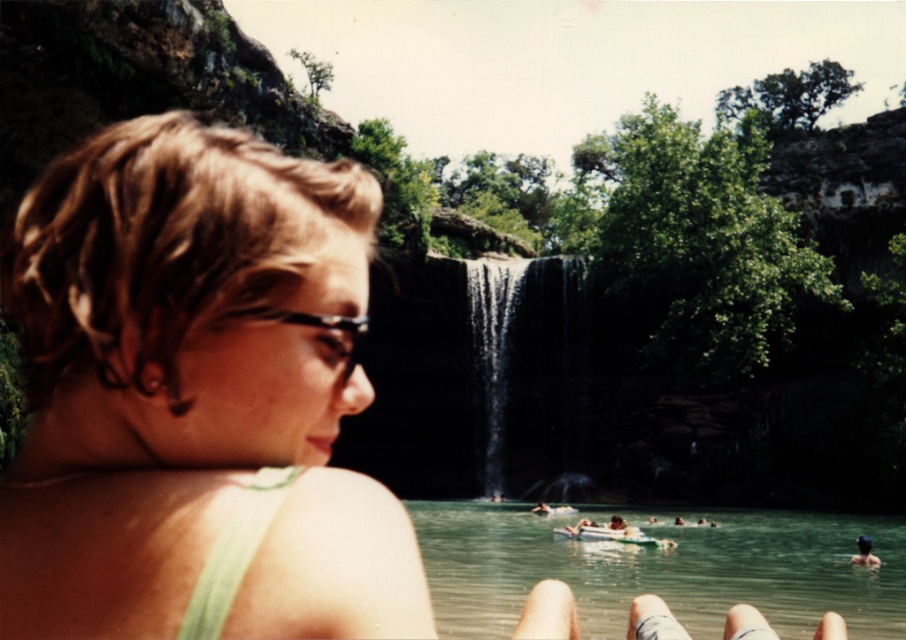
You are a photographer planning to take a photo of the green fabric bikini top at center and the black glossy waterfall at center. Which object should you focus on first if you want to capture both in the same frame without moving the camera?

The green fabric bikini top at center is bigger than the black glossy waterfall at center, so you should focus on the green fabric bikini top at center first to ensure it is in sharp focus before adjusting for the waterfall.

You are a photographer trying to capture the green fabric bikini top at center. You notice a point marked at coordinates (193,390). Is this point located on the green fabric bikini top at center?

Yes, the point (193,390) is on the green fabric bikini top at center according to the description.

You are a photographer trying to capture the scene with the green fabric bikini top at center and the green water at lower center. Which object should you focus on first if you want to take a picture from the left side of the scene?

The green fabric bikini top at center is to the left of green water at lower center, so you should focus on the green fabric bikini top at center first to capture both objects in the frame from the left side.